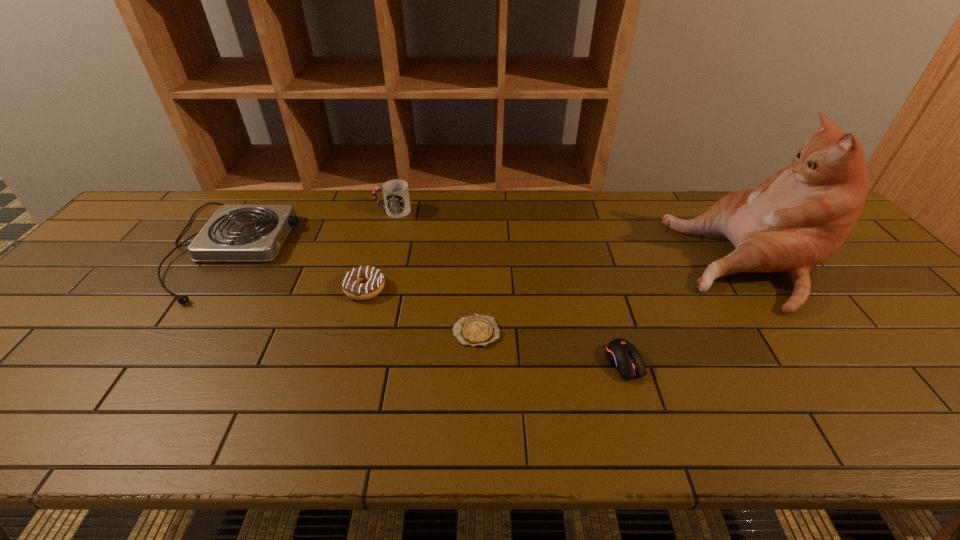
Find the location of a particular element. Image resolution: width=960 pixels, height=540 pixels. the tallest object is located at coordinates (797, 218).

This screenshot has height=540, width=960. Identify the location of the rightmost object. (797, 218).

Where is `cup`? This screenshot has width=960, height=540. cup is located at coordinates (396, 194).

What are the coordinates of `the third tallest object` in the screenshot? It's located at (236, 232).

Where is `the leftmost object`? Image resolution: width=960 pixels, height=540 pixels. the leftmost object is located at coordinates (236, 232).

The image size is (960, 540). In order to click on doughnut in this screenshot , I will do `click(374, 280)`.

You are a GUI agent. You are given a task and a screenshot of the screen. Output one action in this format:
    pyautogui.click(x=<x>, y=<y>)
    Task: Click on the computer mouse
    The image size is (960, 540).
    Given the screenshot: What is the action you would take?
    pyautogui.click(x=621, y=354)

What are the coordinates of `the shortest object` in the screenshot? It's located at (476, 330).

I want to click on quiche, so click(476, 330).

I want to click on vacant space situated on the face of the rightmost object, so click(x=607, y=263).